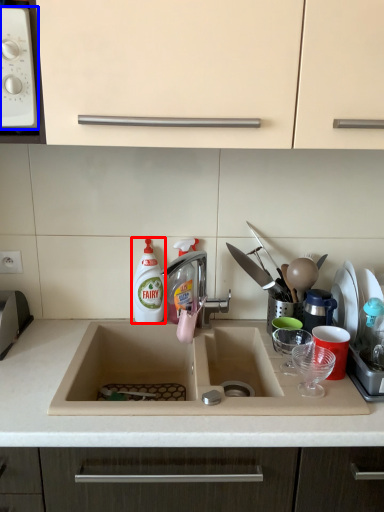
Question: Which object appears closest to the camera in this image, cleaning product (highlighted by a red box) or home appliance (highlighted by a blue box)?

Choices:
 (A) cleaning product
 (B) home appliance

Answer: (B)